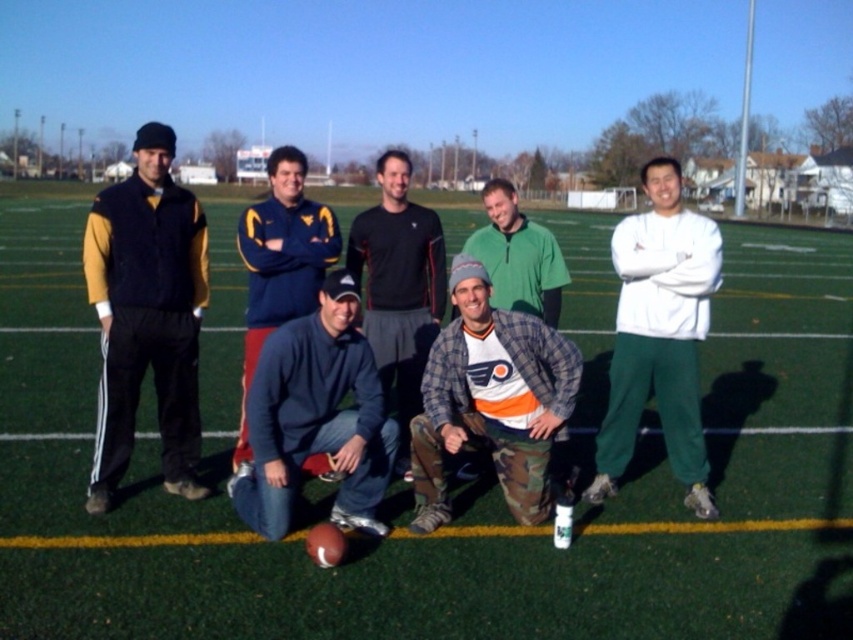
You are a photographer taking a photo of the group. You want to ensure that both the camouflage pants at center and the white fleece sweatshirt at right are clearly visible. Based on their positions, which one might be partially hidden and why?

The camouflage pants at center might be partially hiding the white fleece sweatshirt at right because it is positioned in front of it.

Consider the image. You are standing at the origin point of the football field and want to walk towards the point labeled point (403, 445). However, there is an obstacle at point (503, 227). Will you encounter the obstacle before reaching your destination?

Yes, you will encounter the obstacle at point (503, 227) before reaching point (403, 445) because point (403, 445) is behind point (503, 227).

You are a photographer standing at the edge of the football field. You notice two items of clothing at the center of the image, the camo pants at center and the blue fleece at center. Which one appears closer to you?

The camo pants at center is further to the viewer than blue fleece at center, so the blue fleece at center appears closer to you.